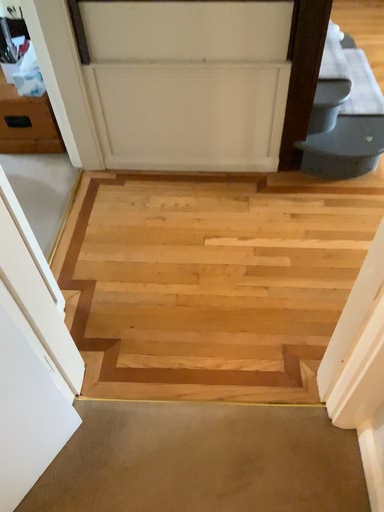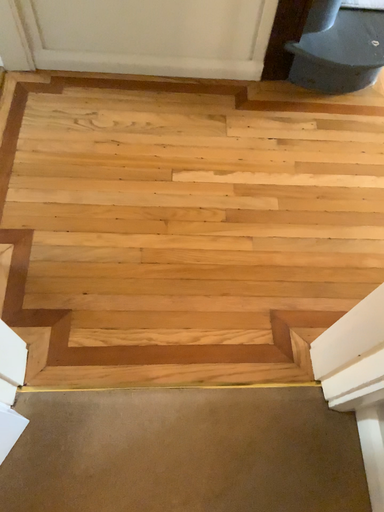
Question: How did the camera likely rotate when shooting the video?

Choices:
 (A) rotated left
 (B) rotated right

Answer: (B)